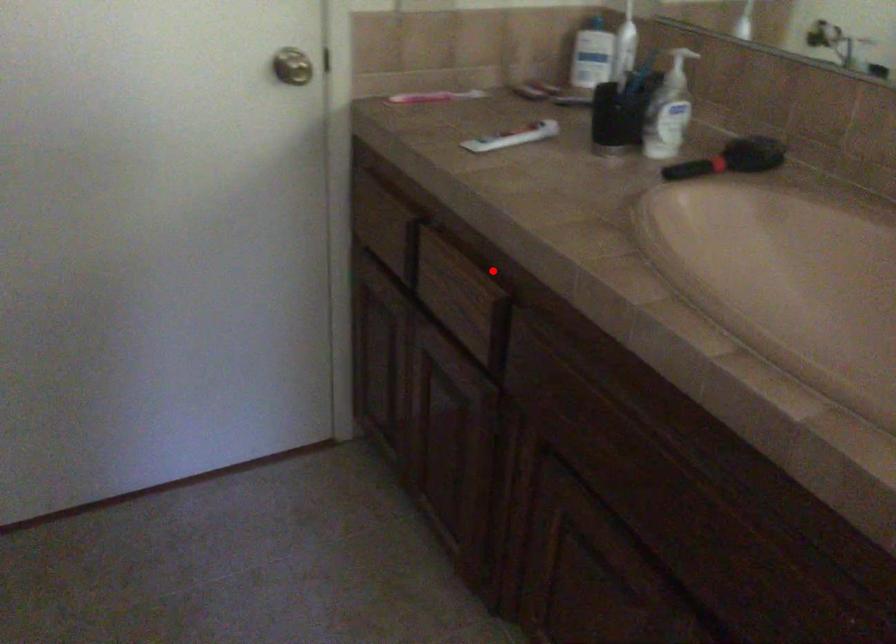
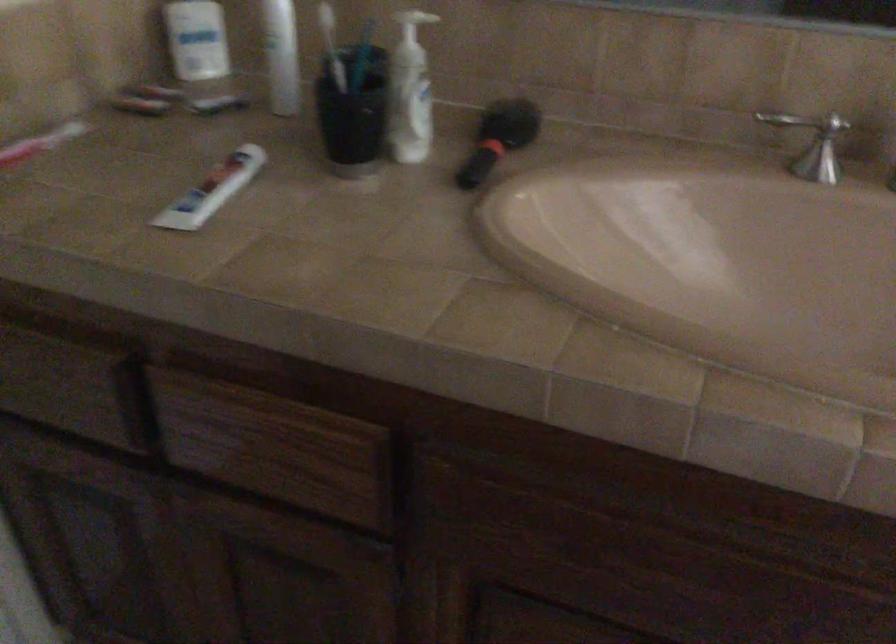
In the second image, find the point that corresponds to the highlighted location in the first image.

(341, 404)